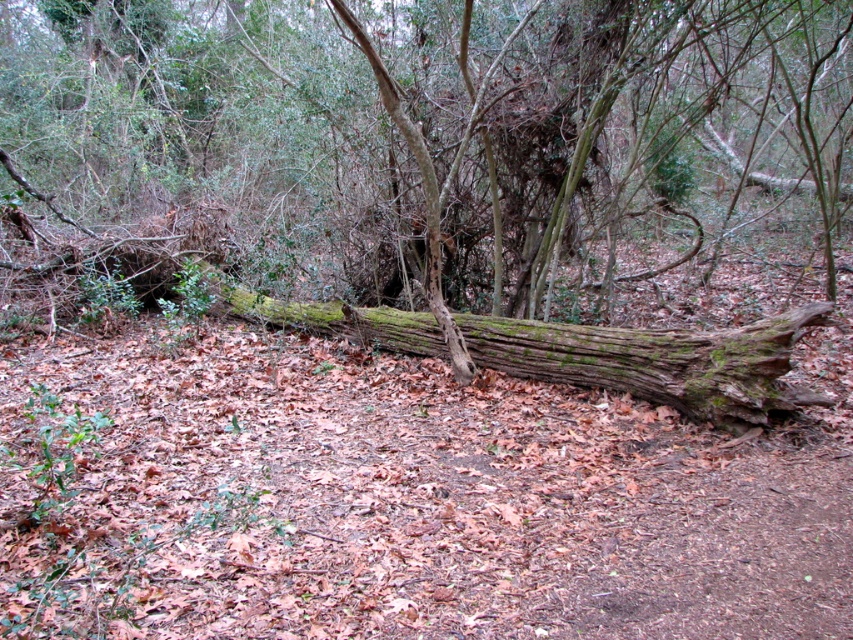
In the scene shown: You are standing at the center of the woodland scene. There is a point marked at coordinates (422, 141). What object does this point correspond to?

The point at coordinates (422, 141) corresponds to the green mossy log at center.